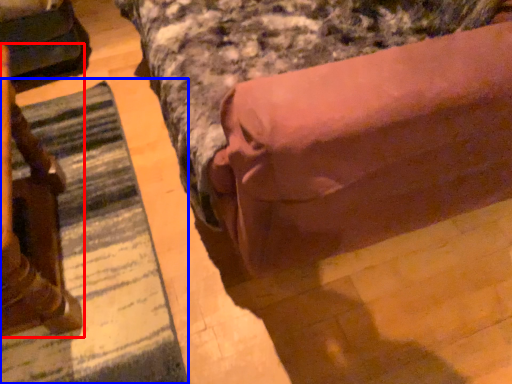
Question: Among these objects, which one is nearest to the camera, furniture (highlighted by a red box) or mat (highlighted by a blue box)?

Choices:
 (A) furniture
 (B) mat

Answer: (A)